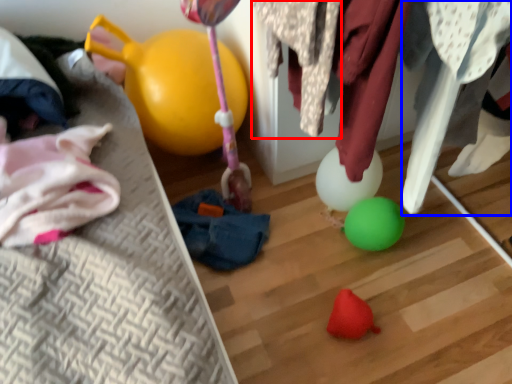
Question: Which of the following is the farthest to the observer, clothing (highlighted by a red box) or clothing (highlighted by a blue box)?

Choices:
 (A) clothing
 (B) clothing

Answer: (B)